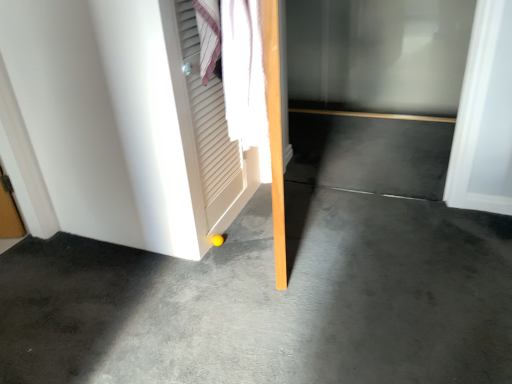
Question: Is matte white door at lower left oriented away from transparent glass door at center?

Choices:
 (A) no
 (B) yes

Answer: (A)

Question: Is matte white door at lower left smaller than transparent glass door at center?

Choices:
 (A) yes
 (B) no

Answer: (B)

Question: From the image's perspective, is matte white door at lower left below transparent glass door at center?

Choices:
 (A) no
 (B) yes

Answer: (B)

Question: Can you confirm if matte white door at lower left is thinner than transparent glass door at center?

Choices:
 (A) no
 (B) yes

Answer: (A)

Question: Can you confirm if matte white door at lower left is shorter than transparent glass door at center?

Choices:
 (A) no
 (B) yes

Answer: (A)

Question: Based on their sizes in the image, would you say matte white door at lower left is bigger or smaller than white louvered screen door at upper left?

Choices:
 (A) big
 (B) small

Answer: (A)

Question: Is point (101, 144) positioned closer to the camera than point (219, 216)?

Choices:
 (A) closer
 (B) farther

Answer: (A)

Question: From their relative heights in the image, would you say matte white door at lower left is taller or shorter than white louvered screen door at upper left?

Choices:
 (A) short
 (B) tall

Answer: (B)

Question: Considering their positions, is matte white door at lower left located in front of or behind white louvered screen door at upper left?

Choices:
 (A) front
 (B) behind

Answer: (B)

Question: Considering the relative positions of transparent glass door at center and gray concrete at center in the image provided, is transparent glass door at center to the left or to the right of gray concrete at center?

Choices:
 (A) right
 (B) left

Answer: (A)

Question: In the image, is transparent glass door at center positioned in front of or behind gray concrete at center?

Choices:
 (A) front
 (B) behind

Answer: (B)

Question: Is transparent glass door at center wider or thinner than gray concrete at center?

Choices:
 (A) thin
 (B) wide

Answer: (A)

Question: Does point (433, 44) appear closer or farther from the camera than point (413, 230)?

Choices:
 (A) closer
 (B) farther

Answer: (B)

Question: From a real-world perspective, is matte white door at lower left physically located above or below gray concrete at center?

Choices:
 (A) above
 (B) below

Answer: (A)

Question: From the image's perspective, is matte white door at lower left above or below gray concrete at center?

Choices:
 (A) above
 (B) below

Answer: (A)